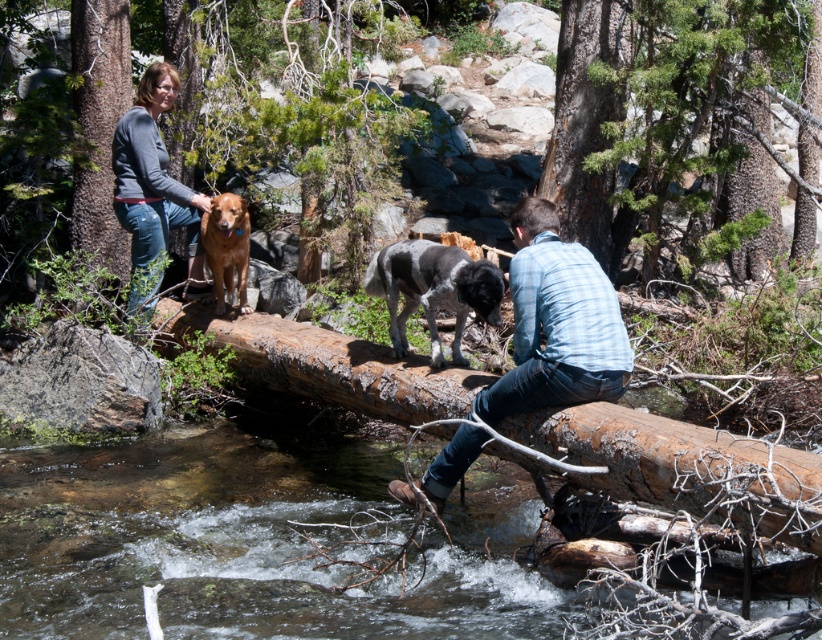
You are a photographer standing in the forest scene. You want to take a photo that includes both the brown rough log at center and the brown rough bark tree trunk at center. Which object should you focus on first to ensure both are in sharp focus?

You should focus on the brown rough log at center first because it is closer to the viewer than the brown rough bark tree trunk at center, so adjusting focus from near to far will help both objects be in sharp focus.

You are a photographer trying to capture a shot of the brown rough log at center and the matte gray sweater at upper left. Since you want both subjects to be in focus, you need to know which one is closer to the camera. Which object is closer?

The brown rough log at center is shorter than the matte gray sweater at upper left, so the brown rough log at center is closer to the camera.